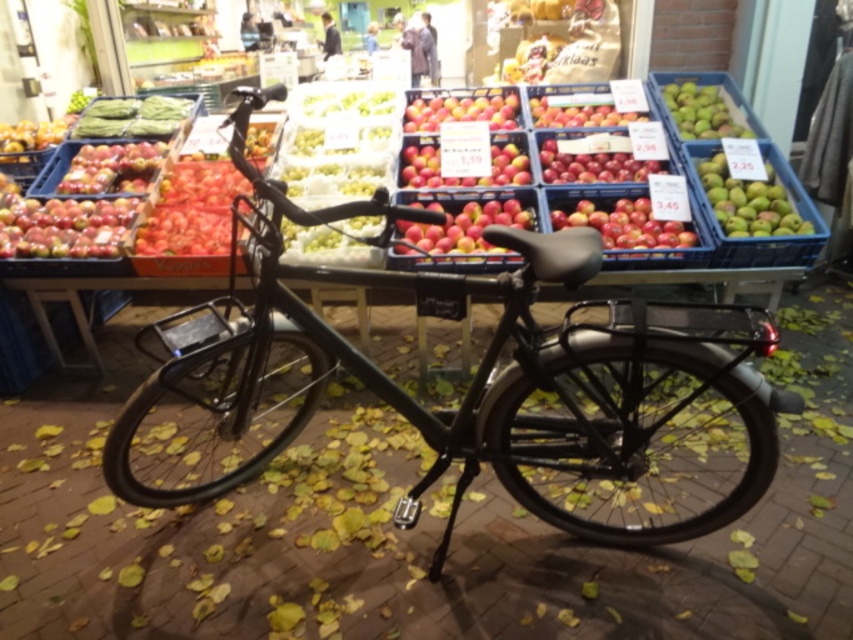
Does matte red apple at left have a greater height compared to red matte apple at center?

No, matte red apple at left is not taller than red matte apple at center.

Between point (51, 243) and point (636, 236), which one is positioned in front?

Positioned in front is point (636, 236).

I want to click on matte red apple at left, so click(x=65, y=227).

Which is above, matte red apple at left or red matte apples at center?

Positioned higher is matte red apple at left.

Which of these two, matte red apple at left or red matte apples at center, stands shorter?

Standing shorter between the two is red matte apples at center.

Where is `matte red apple at left`? This screenshot has height=640, width=853. matte red apple at left is located at coordinates (65, 227).

This screenshot has width=853, height=640. Find the location of `matte red apple at left`. matte red apple at left is located at coordinates (65, 227).

Which is behind, point (637, 381) or point (669, 236)?

The point (669, 236) is more distant.

Is matte black bicycle at center above red matte apple at center?

No.

Is point (186, 348) less distant than point (606, 236)?

That is True.

You are a GUI agent. You are given a task and a screenshot of the screen. Output one action in this format:
    pyautogui.click(x=<x>, y=<y>)
    Task: Click on the matte black bicycle at center
    The height and width of the screenshot is (640, 853).
    Given the screenshot: What is the action you would take?
    pyautogui.click(x=471, y=380)